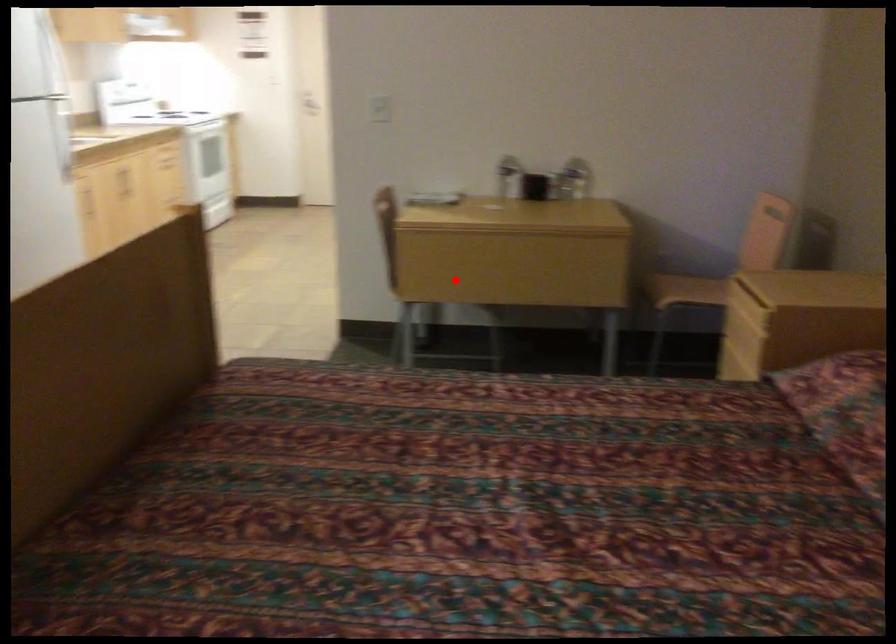
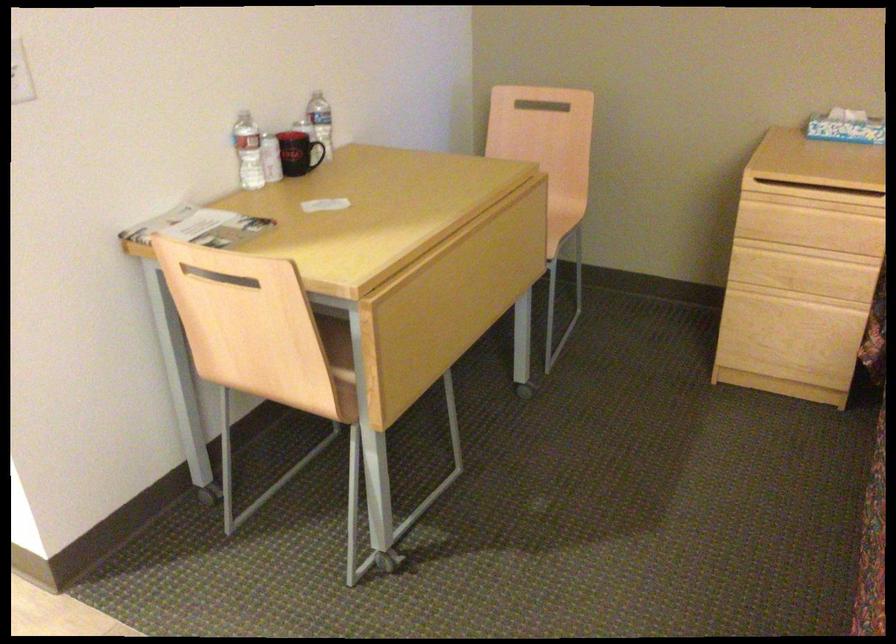
Locate, in the second image, the point that corresponds to the highlighted location in the first image.

(338, 357)